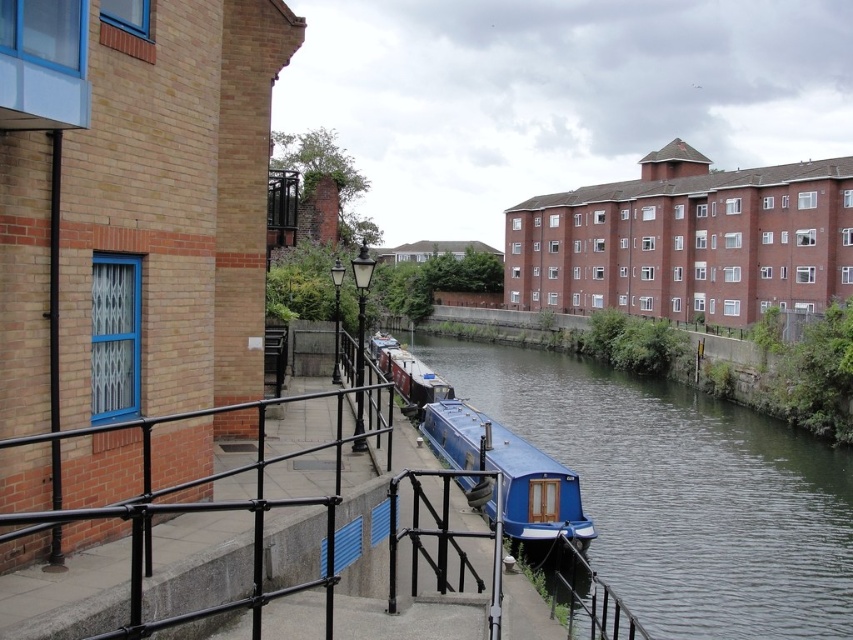
Which is below, blue glossy boat at center or matte blue boat at center?

blue glossy boat at center is lower down.

Is point (581, 424) less distant than point (583, 545)?

No.

Is point (521, 413) behind point (561, 477)?

That is True.

At what (x,y) coordinates should I click in order to perform the action: click on blue glossy boat at center. Please return your answer as a coordinate pair (x, y). The height and width of the screenshot is (640, 853). Looking at the image, I should click on (677, 490).